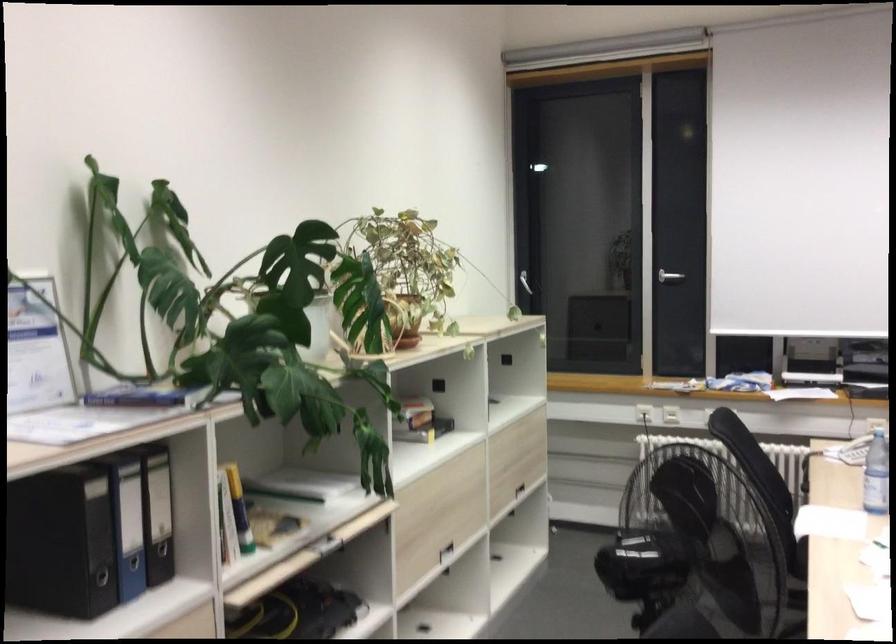
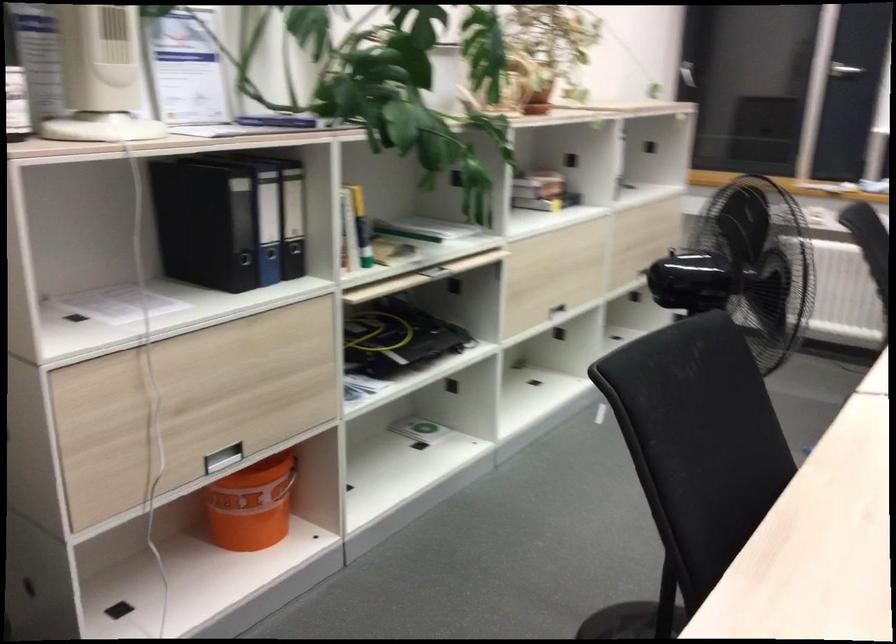
Question: Based on the continuous images, in which direction is the camera rotating? Reply with the corresponding letter.

Choices:
 (A) Left
 (B) Right
 (C) Up
 (D) Down

Answer: (D)